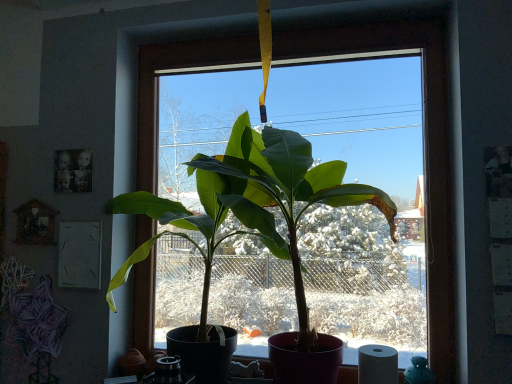
Question: Is green matte plant at center bigger or smaller than white matte toilet paper at lower right?

Choices:
 (A) small
 (B) big

Answer: (B)

Question: In terms of height, does green matte plant at center look taller or shorter compared to white matte toilet paper at lower right?

Choices:
 (A) short
 (B) tall

Answer: (B)

Question: Is green matte plant at center situated inside white matte toilet paper at lower right or outside?

Choices:
 (A) outside
 (B) inside

Answer: (A)

Question: From a real-world perspective, is white matte toilet paper at lower right above or below green matte plant at center?

Choices:
 (A) below
 (B) above

Answer: (A)

Question: Looking at their shapes, would you say white matte toilet paper at lower right is wider or thinner than green matte plant at center?

Choices:
 (A) thin
 (B) wide

Answer: (A)

Question: From the image's perspective, is white matte toilet paper at lower right above or below green matte plant at center?

Choices:
 (A) above
 (B) below

Answer: (B)

Question: Visually, is white matte toilet paper at lower right positioned to the left or to the right of green matte plant at center?

Choices:
 (A) left
 (B) right

Answer: (B)